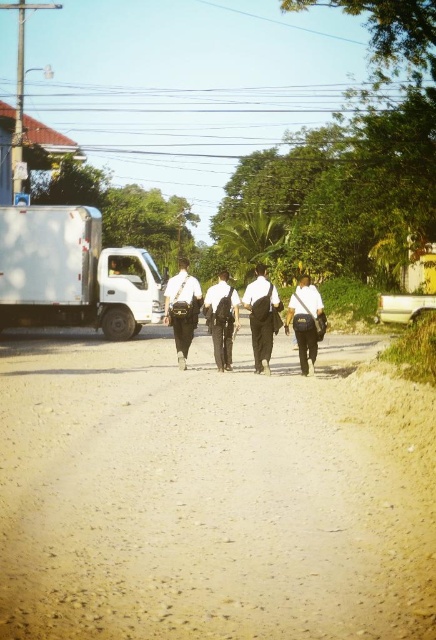
Question: Can you confirm if dark gray uniform at center is positioned to the left of black leather pants at center?

Choices:
 (A) yes
 (B) no

Answer: (B)

Question: Does dark gray uniform at center lie in front of matte black bag at center?

Choices:
 (A) yes
 (B) no

Answer: (B)

Question: Which point appears closest to the camera in this image?

Choices:
 (A) coord(269,344)
 (B) coord(215,328)
 (C) coord(309,310)
 (D) coord(196,285)

Answer: (C)

Question: Does matte black bag at center come in front of black leather pants at center?

Choices:
 (A) yes
 (B) no

Answer: (A)

Question: Which of the following is the farthest from the observer?

Choices:
 (A) matte black bag at center
 (B) dark gray uniform at center
 (C) black leather pants at center
 (D) brown gravel road at center

Answer: (C)

Question: Which object is closer to the camera taking this photo?

Choices:
 (A) brown gravel road at center
 (B) dark gray uniform at center
 (C) matte black bag at center

Answer: (A)